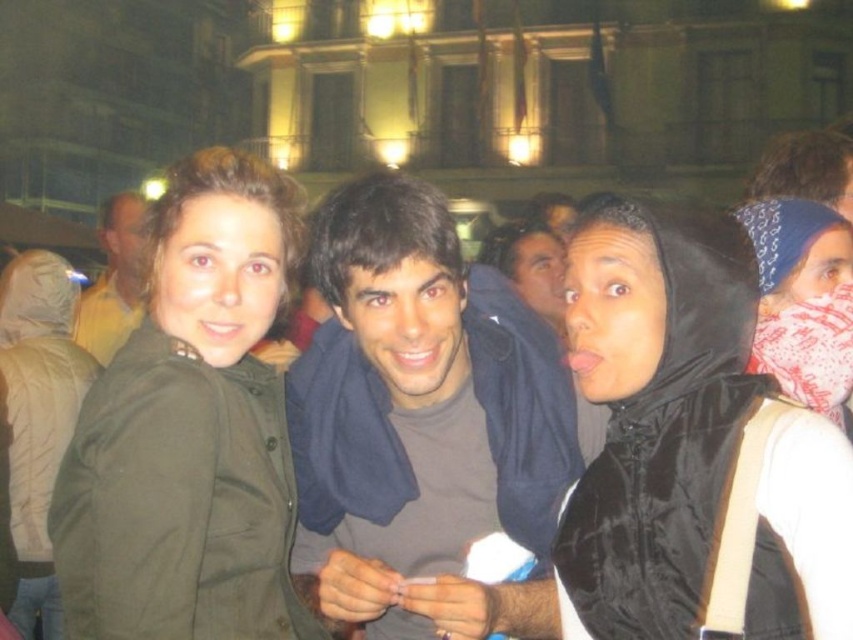
You are a photographer trying to focus on the smooth brown shirt at center and the matte black jacket at center. Which of these two items is located lower in the image?

The smooth brown shirt at center is positioned under the matte black jacket at center, so it is located lower in the image.